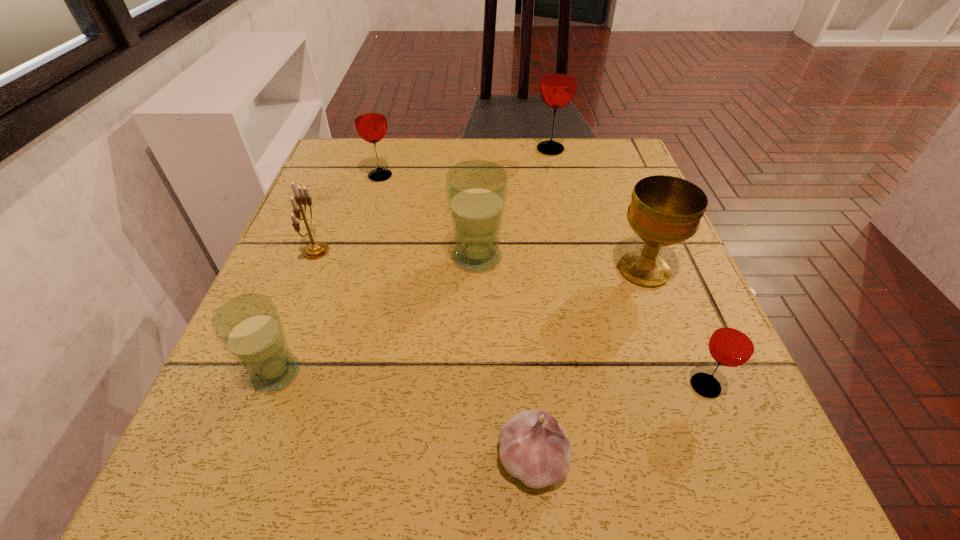
Find the location of a particular element. vacant space that satisfies the following two spatial constraints: 1. on the back side of the candelabrum; 2. on the right side of the leftmost red glass is located at coordinates (346, 176).

I want to click on vacant space that satisfies the following two spatial constraints: 1. on the back side of the nearer blue glass; 2. on the left side of the second red glass from right to left, so click(361, 149).

Identify the location of vacant space that satisfies the following two spatial constraints: 1. on the front side of the chalice; 2. on the left side of the rightmost red glass. (687, 386).